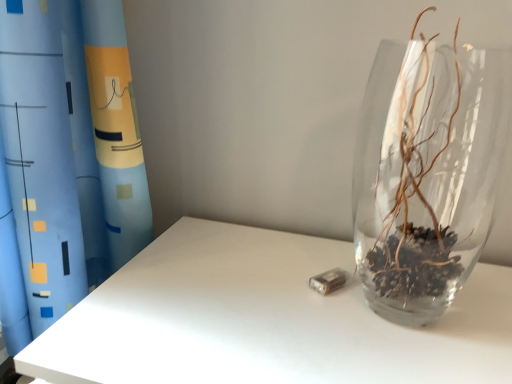
Question: Looking at their shapes, would you say blue fabric curtain at upper left is wider or thinner than transparent glass vase at right?

Choices:
 (A) thin
 (B) wide

Answer: (B)

Question: From the image's perspective, is blue fabric curtain at upper left above or below transparent glass vase at right?

Choices:
 (A) above
 (B) below

Answer: (A)

Question: Does point (41, 173) appear closer or farther from the camera than point (391, 190)?

Choices:
 (A) farther
 (B) closer

Answer: (B)

Question: From a real-world perspective, relative to blue fabric curtain at upper left, is transparent glass vase at right vertically above or below?

Choices:
 (A) below
 (B) above

Answer: (B)

Question: Is point (397, 94) closer or farther from the camera than point (31, 39)?

Choices:
 (A) closer
 (B) farther

Answer: (B)

Question: In terms of size, does transparent glass vase at right appear bigger or smaller than blue fabric curtain at upper left?

Choices:
 (A) small
 (B) big

Answer: (A)

Question: In terms of width, does transparent glass vase at right look wider or thinner when compared to blue fabric curtain at upper left?

Choices:
 (A) wide
 (B) thin

Answer: (B)